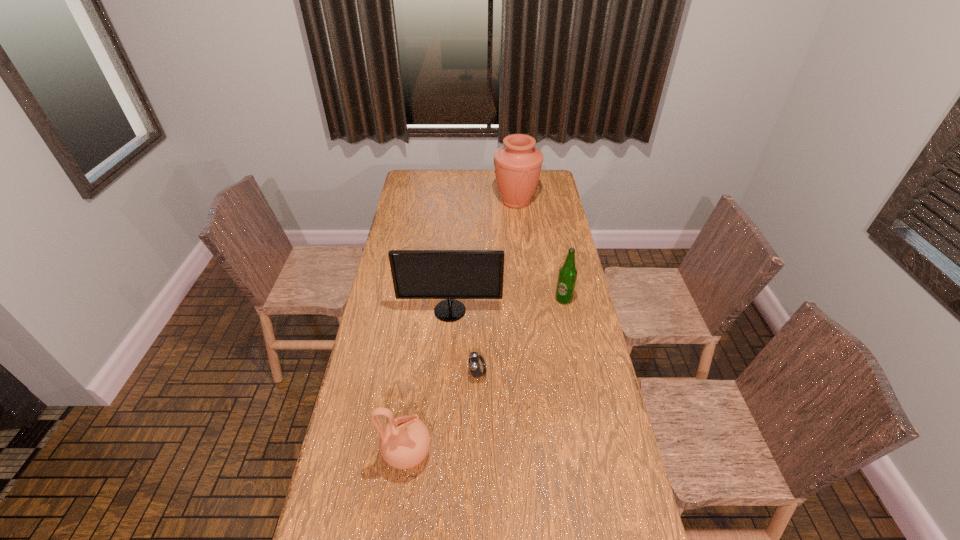
Find the location of a particular element. free region that satisfies the following two spatial constraints: 1. on the front-facing side of the computer monitor; 2. on the spout of the pottery is located at coordinates (441, 453).

The image size is (960, 540). Identify the location of free space that satisfies the following two spatial constraints: 1. on the label of the beer bottle; 2. on the face of the shortest object. pos(578,373).